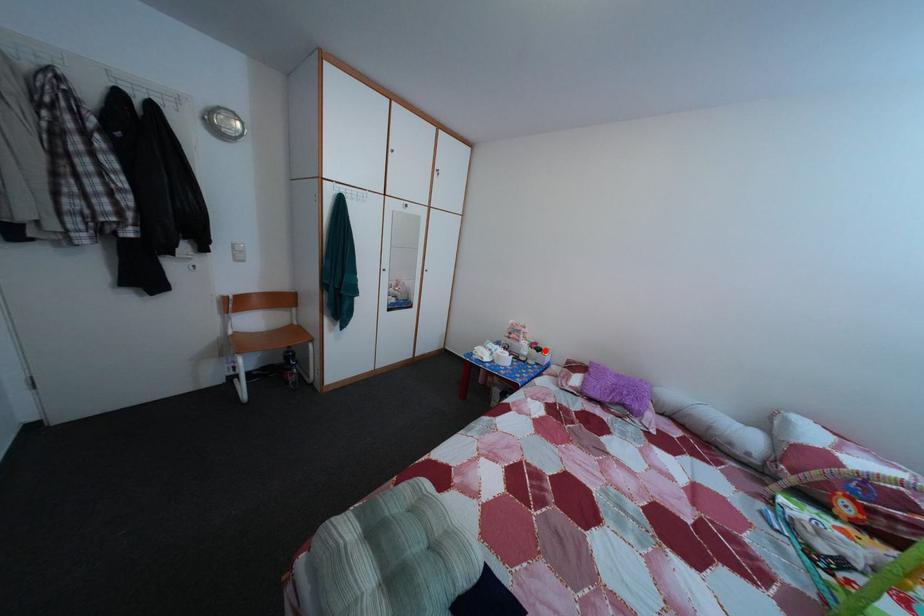
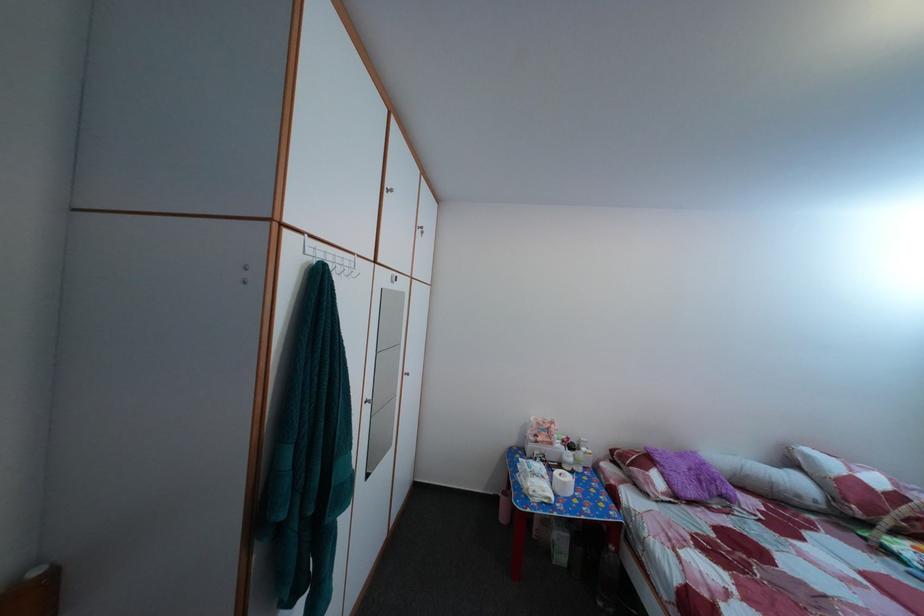
Find the pixel in the second image that matches the highlighted location in the first image.

(578, 447)